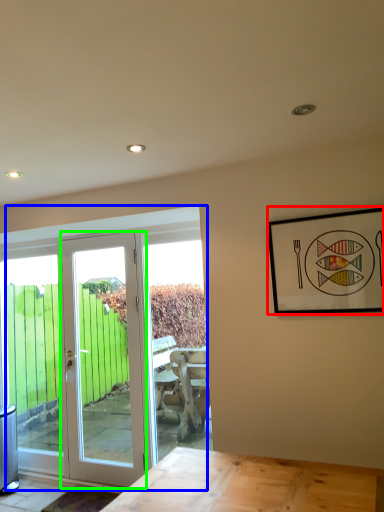
Question: Estimate the real-world distances between objects in this image. Which object is closer to picture frame (highlighted by a red box), door (highlighted by a blue box) or door (highlighted by a green box)?

Choices:
 (A) door
 (B) door

Answer: (A)